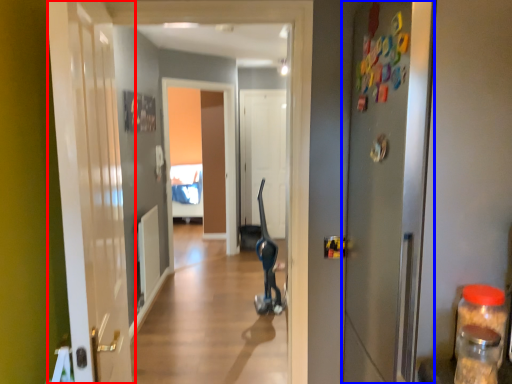
Question: Which object is further to the camera taking this photo, door (highlighted by a red box) or door (highlighted by a blue box)?

Choices:
 (A) door
 (B) door

Answer: (B)